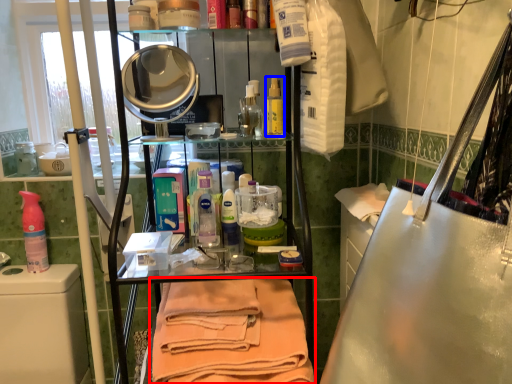
Question: Which object is closer to the camera taking this photo, towel (highlighted by a red box) or mouthwash (highlighted by a blue box)?

Choices:
 (A) towel
 (B) mouthwash

Answer: (A)